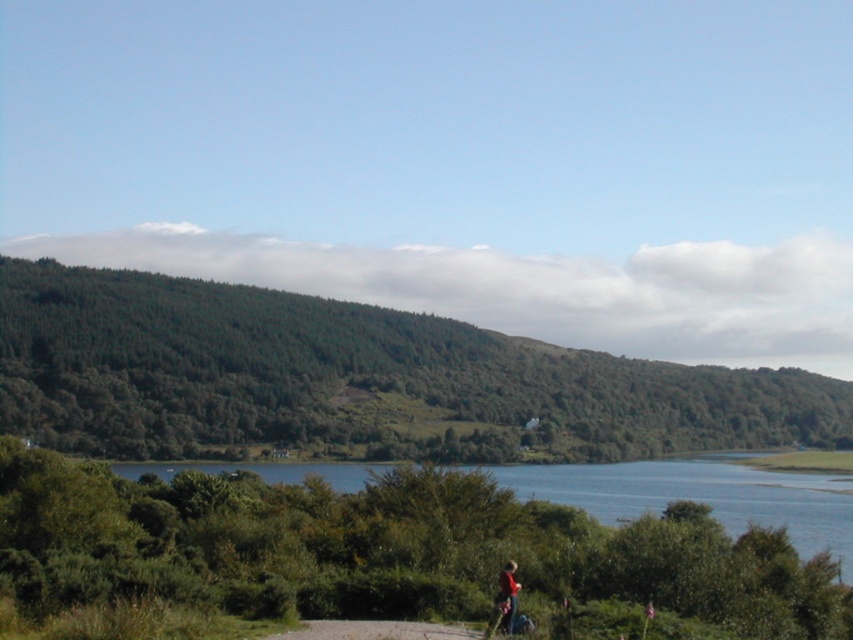
Question: Does green leafy hill at center have a larger size compared to red fabric jacket at lower right?

Choices:
 (A) yes
 (B) no

Answer: (A)

Question: Is green leafy hill at center thinner than blue water at center?

Choices:
 (A) yes
 (B) no

Answer: (B)

Question: Which object is the farthest from the blue water at center?

Choices:
 (A) green leafy hill at center
 (B) red fabric jacket at lower right

Answer: (B)

Question: Which object is farther from the camera taking this photo?

Choices:
 (A) red fabric jacket at lower right
 (B) blue water at center
 (C) green leafy hill at center

Answer: (C)

Question: Which point is farther to the camera?

Choices:
 (A) green leafy hill at center
 (B) red fabric jacket at lower right
 (C) blue water at center

Answer: (A)

Question: Can you confirm if green leafy hill at center is bigger than blue water at center?

Choices:
 (A) yes
 (B) no

Answer: (A)